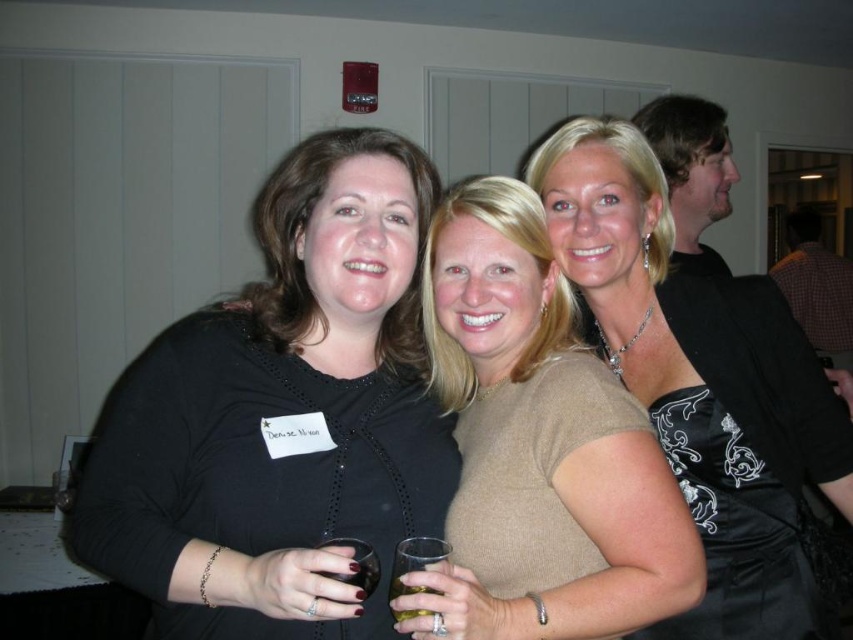
Question: Is black matte dress at center wider than translucent glass at center?

Choices:
 (A) no
 (B) yes

Answer: (B)

Question: Does black matte dress at center appear on the right side of translucent glass at lower left?

Choices:
 (A) no
 (B) yes

Answer: (A)

Question: Which object is farther from the camera taking this photo?

Choices:
 (A) matte black dress at center
 (B) black matte dress at center

Answer: (A)

Question: Which of the following is the farthest from the observer?

Choices:
 (A) translucent glass at lower left
 (B) black matte dress at center
 (C) beige jersey top at center

Answer: (C)

Question: Which point appears closest to the camera in this image?

Choices:
 (A) (372, 472)
 (B) (503, 442)

Answer: (A)

Question: Is matte black dress at center wider than translucent glass at center?

Choices:
 (A) yes
 (B) no

Answer: (A)